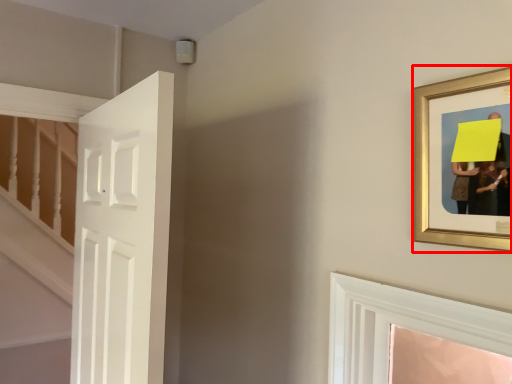
Question: From the image's perspective, considering the relative positions of picture frame (annotated by the red box) and door in the image provided, where is picture frame (annotated by the red box) located with respect to the staircase?

Choices:
 (A) above
 (B) below

Answer: (A)